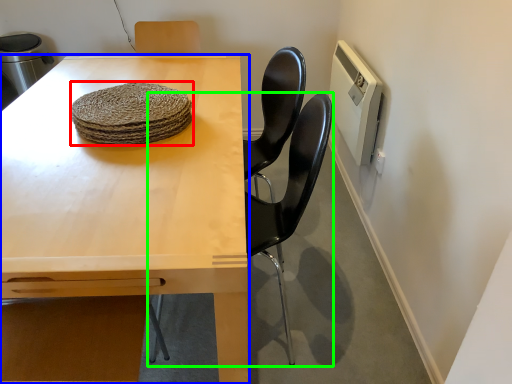
Question: Which object is positioned farthest from food (highlighted by a red box)? Select from table (highlighted by a blue box) and chair (highlighted by a green box).

Choices:
 (A) table
 (B) chair

Answer: (B)